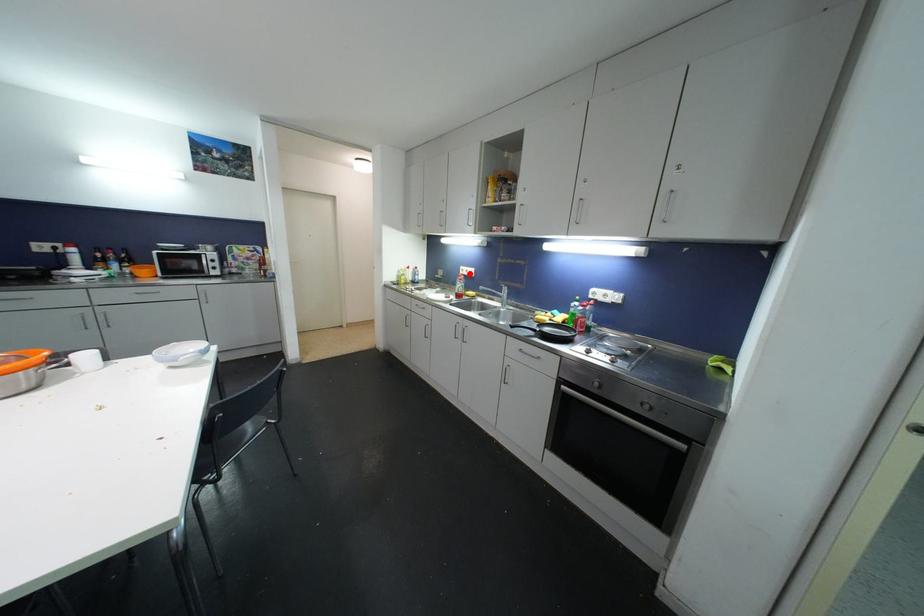
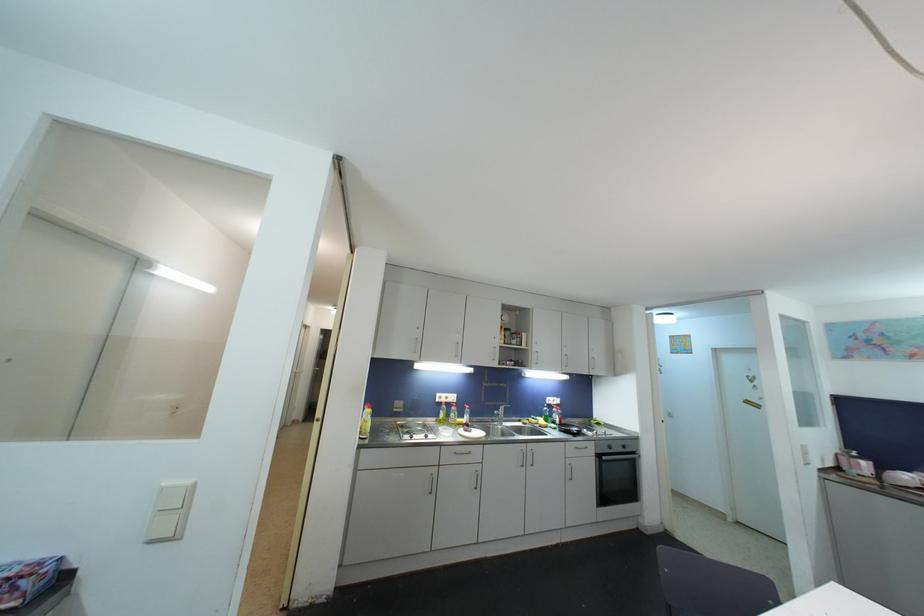
Question: I am providing you with two images of the same scene from different viewpoints. A red point is shown in image1. For the corresponding object point in image2, is it positioned nearer or farther from the camera?

Choices:
 (A) Nearer
 (B) Farther

Answer: (B)